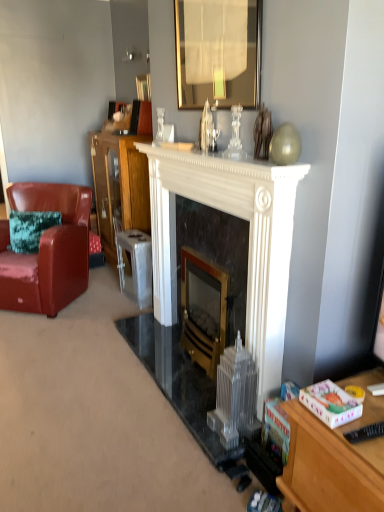
Where is `vacant region to the left of black marble fireplace at center, the second fireplace from the left`? This screenshot has width=384, height=512. vacant region to the left of black marble fireplace at center, the second fireplace from the left is located at coordinates (146, 349).